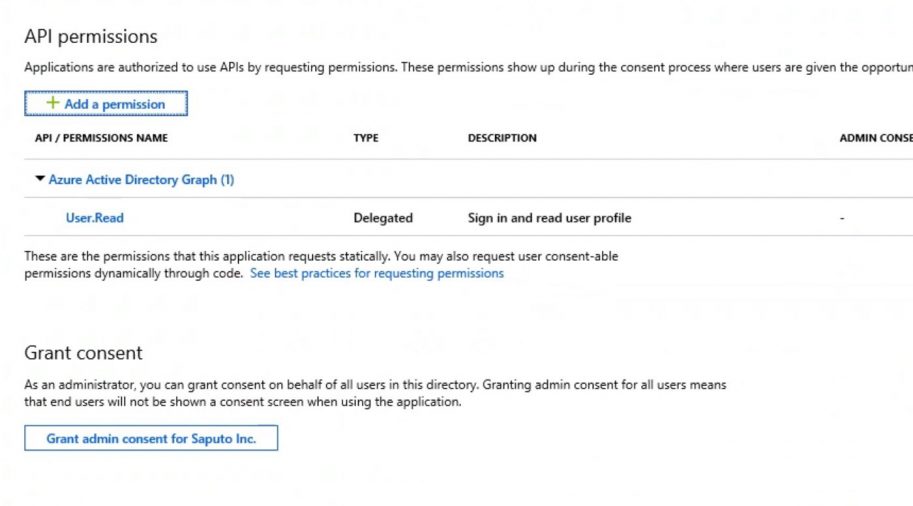
Where is `light grey separator line`? Image resolution: width=913 pixels, height=506 pixels. light grey separator line is located at coordinates (428, 233), (429, 196), (426, 157).